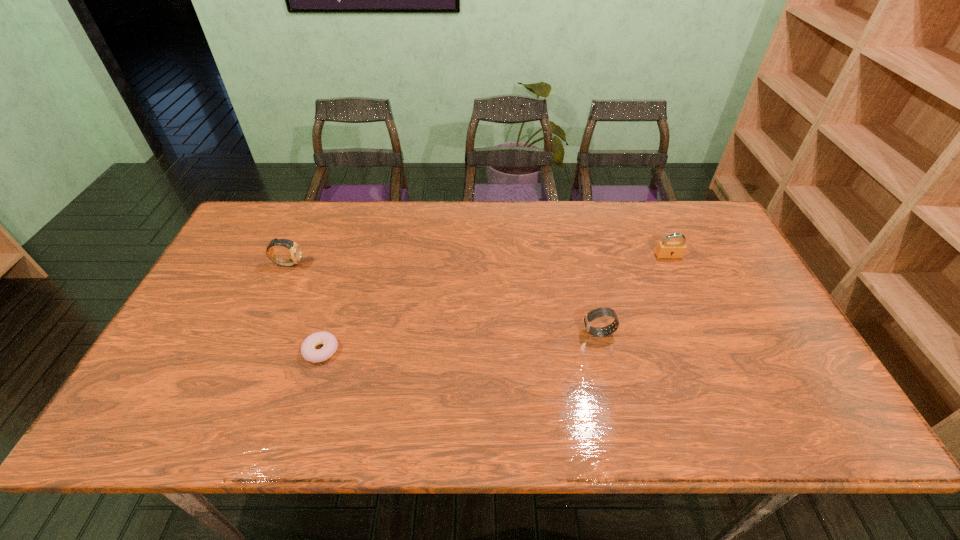
You are a GUI agent. You are given a task and a screenshot of the screen. Output one action in this format:
    pyautogui.click(x=<x>, y=<y>)
    Task: Click on the blank region between the shortest object and the rightmost object
    Image resolution: width=960 pixels, height=540 pixels.
    Given the screenshot: What is the action you would take?
    pyautogui.click(x=494, y=303)

You are a GUI agent. You are given a task and a screenshot of the screen. Output one action in this format:
    pyautogui.click(x=<x>, y=<y>)
    Task: Click on the free space between the rightmost object and the left watch
    The height and width of the screenshot is (540, 960).
    Given the screenshot: What is the action you would take?
    pyautogui.click(x=478, y=260)

Locate an element on the screen. Image resolution: width=960 pixels, height=540 pixels. vacant area that lies between the rightmost object and the left watch is located at coordinates (478, 260).

At what (x,y) coordinates should I click in order to perform the action: click on free area in between the padlock and the right watch. Please return your answer as a coordinate pair (x, y). The height and width of the screenshot is (540, 960). Looking at the image, I should click on (634, 294).

The width and height of the screenshot is (960, 540). In order to click on empty location between the leftmost object and the rightmost object in this screenshot , I will do `click(478, 260)`.

Locate an element on the screen. The image size is (960, 540). empty location between the farther watch and the rightmost object is located at coordinates (478, 260).

Image resolution: width=960 pixels, height=540 pixels. I want to click on free space that is in between the rightmost object and the right watch, so click(x=634, y=294).

Locate an element on the screen. free area in between the rightmost object and the shortest object is located at coordinates (494, 303).

Image resolution: width=960 pixels, height=540 pixels. Identify the location of empty space between the farther watch and the padlock. (478, 260).

Identify which object is the closest to the farther watch. Please provide its 2D coordinates. Your answer should be formatted as a tuple, i.e. [(x, y)], where the tuple contains the x and y coordinates of a point satisfying the conditions above.

[(308, 351)]